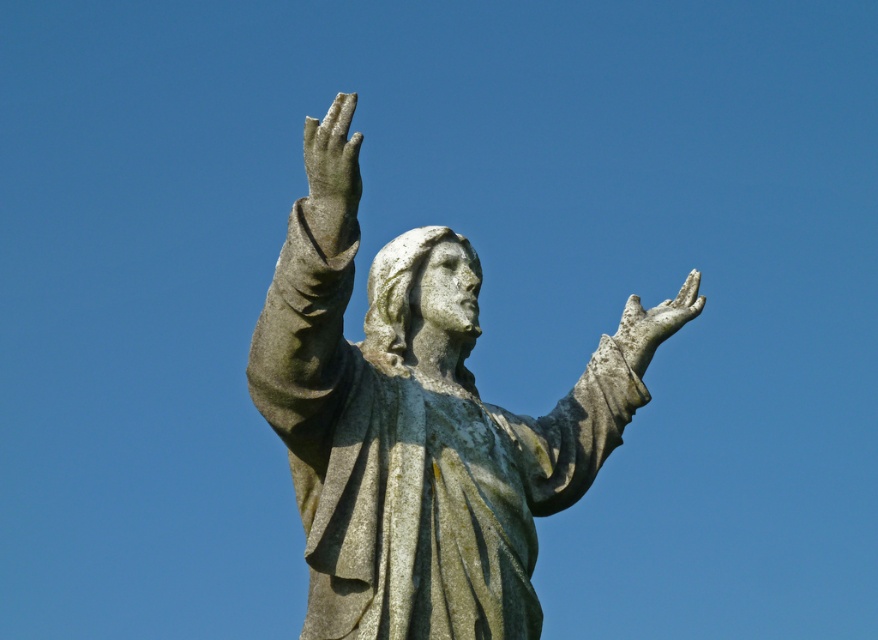
Who is shorter, gray stone statue at center or gray stone hand at upper center?

gray stone hand at upper center

Can you confirm if gray stone statue at center is wider than gray stone hand at upper center?

Indeed, gray stone statue at center has a greater width compared to gray stone hand at upper center.

Measure the distance between gray stone statue at center and camera.

71.77 meters

The image size is (878, 640). I want to click on gray stone statue at center, so click(x=416, y=440).

Can you confirm if gray stone statue at center is positioned to the right of gray stone hand at upper right?

No, gray stone statue at center is not to the right of gray stone hand at upper right.

This screenshot has height=640, width=878. What do you see at coordinates (416, 440) in the screenshot?
I see `gray stone statue at center` at bounding box center [416, 440].

Find the location of a particular element. This screenshot has height=640, width=878. gray stone statue at center is located at coordinates (416, 440).

Can you confirm if gray stone hand at upper center is taller than gray stone hand at upper right?

In fact, gray stone hand at upper center may be shorter than gray stone hand at upper right.

The height and width of the screenshot is (640, 878). What are the coordinates of `gray stone hand at upper center` in the screenshot? It's located at (332, 164).